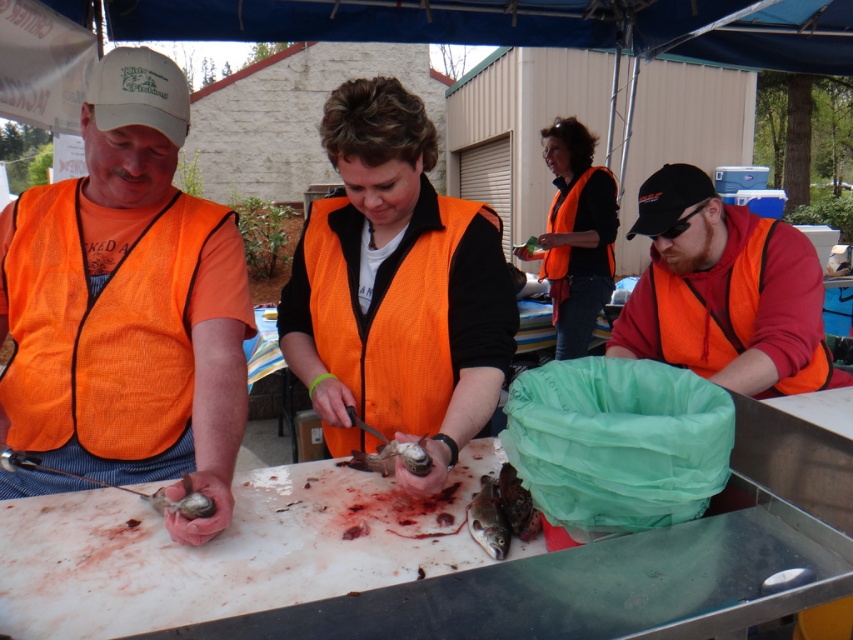
Consider the image. You are a participant in this fish cleaning event and need to locate the orange fabric life jacket at upper center. According to the coordinates provided, where would you find it?

The orange fabric life jacket at upper center is located at coordinates point 0.352 on the x axis and 0.683 on the y axis.

You are at the fish cleaning table and need to hand a tool to the person wearing the orange mesh safety vest at left. Based on their position, which direction should you move to reach them?

The orange mesh safety vest at left is located at point (100, 326), so you should move to the left side of the table to reach them.